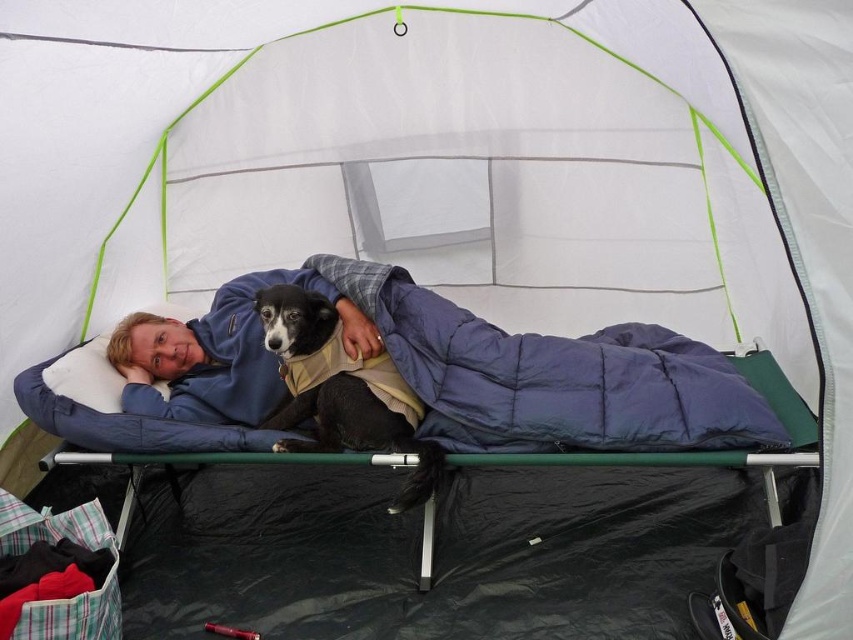
Can you confirm if blue down-filled sleeping bag at center is positioned above black soft fur dog at center?

Indeed, blue down-filled sleeping bag at center is positioned over black soft fur dog at center.

Locate an element on the screen. The image size is (853, 640). blue down-filled sleeping bag at center is located at coordinates (550, 376).